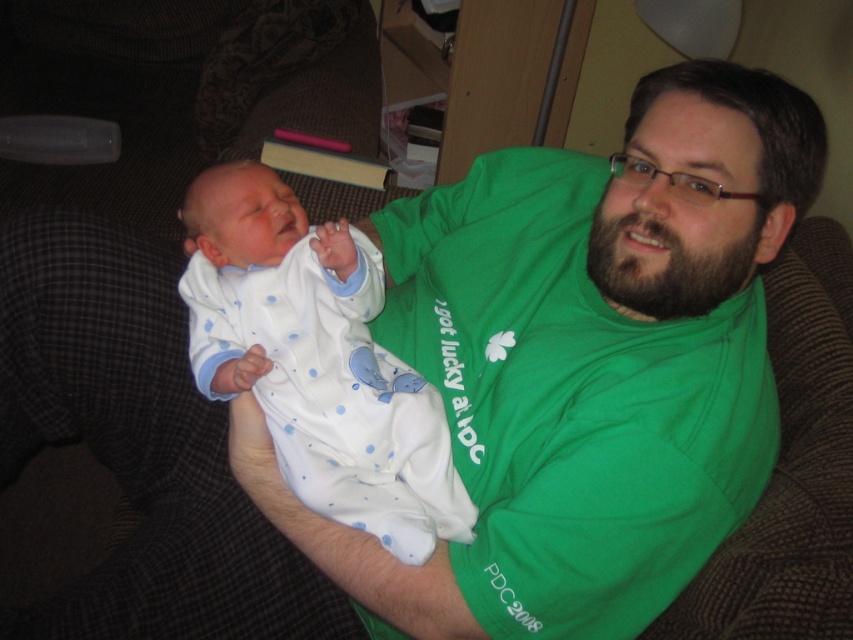
Does green cotton shirt at center have a greater width compared to white soft fabric newborn at center?

Correct, the width of green cotton shirt at center exceeds that of white soft fabric newborn at center.

Is green cotton shirt at center below white soft fabric newborn at center?

Incorrect, green cotton shirt at center is not positioned below white soft fabric newborn at center.

I want to click on green cotton shirt at center, so click(x=582, y=364).